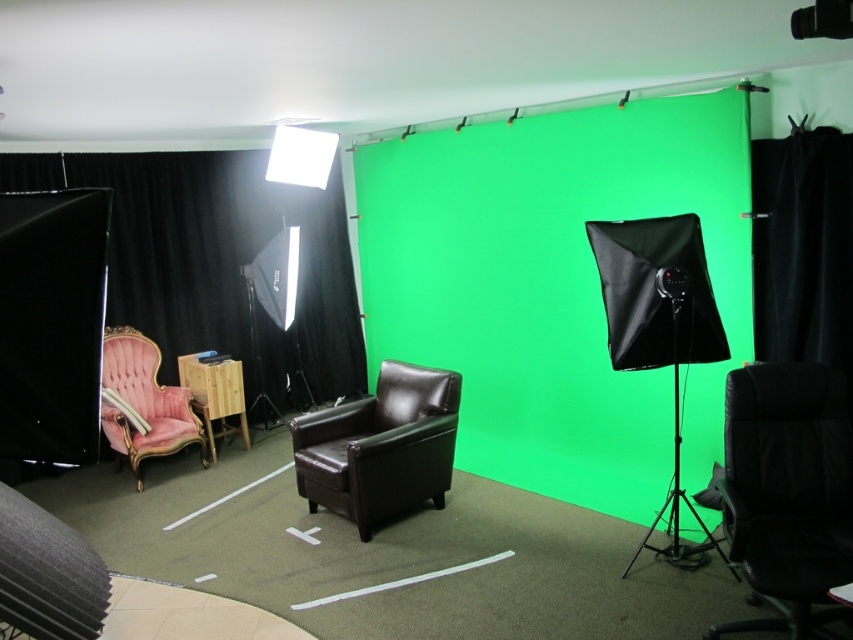
You are setting up a camera in the studio and need to position it to avoid blocking the green screen. The black velvet curtain at left is at a specific coordinate. Which object is closer to the camera if it is placed at the origin point?

The black velvet curtain at left is closer to the camera since it is located at point (218,260), which is nearer to the origin compared to other objects not mentioned here.

You are setting up a video call background using the studio setup. You want to ensure the velvet pink armchair at left is fully visible. Since the black velvet curtain at left might block part of it, which object should you adjust to avoid blocking the view?

The black velvet curtain at left is larger in size than the velvet pink armchair at left, so adjusting the black velvet curtain at left would be necessary to prevent it from blocking the velvet pink armchair at left.

As a director, you need to position a camera to capture both the ornate pink armchair and the modern dark brown leather armchair in the studio setup. However, there is a black velvet curtain at left located at point (218, 260). Will this curtain block the camera view of both chairs?

The black velvet curtain at left located at point (218, 260) is positioned to the left of the chairs. Since the chairs are in front of the green screen and the curtain is at the left edge, it might partially block the view of the ornate pink armchair if it is positioned closer to the left side. However, without exact spatial relationships between the curtain and chairs, a definitive answer isn